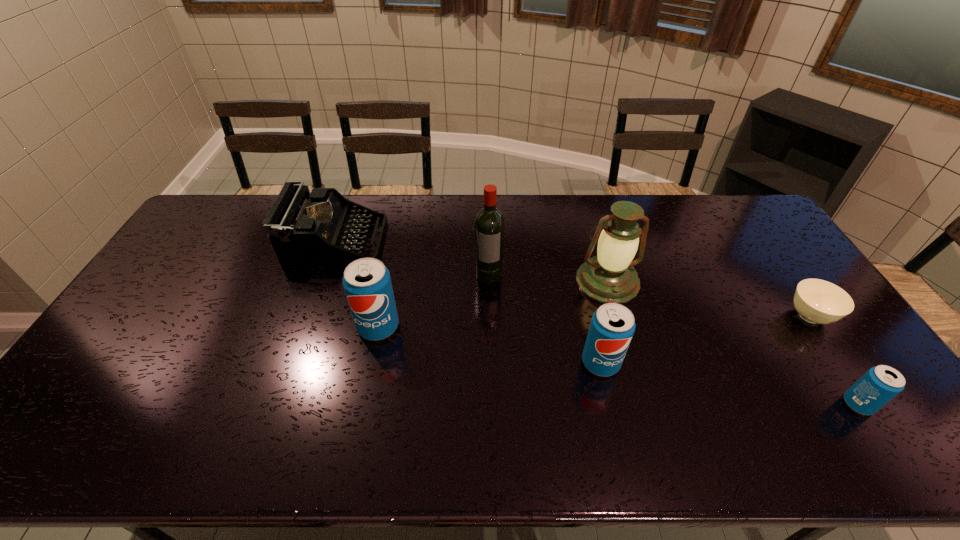
Locate an element on the screen. free region located on the left of the second nearest soda can is located at coordinates (559, 363).

Locate an element on the screen. The width and height of the screenshot is (960, 540). free space located on the left of the rightmost soda can is located at coordinates (714, 404).

Identify the location of vacant region located 0.370m on the label of the third object from left to right. (491, 388).

The height and width of the screenshot is (540, 960). Find the location of `vacant space situated with the light compartment facing forward on the lantern`. vacant space situated with the light compartment facing forward on the lantern is located at coordinates (642, 401).

Locate an element on the screen. blank area located on the typing side of the typewriter is located at coordinates (420, 241).

I want to click on vacant space situated 0.150m on the left of the shortest object, so click(x=734, y=316).

Image resolution: width=960 pixels, height=540 pixels. Identify the location of object at the far edge. (304, 228).

Locate an element on the screen. The width and height of the screenshot is (960, 540). object at the near edge is located at coordinates (880, 384).

Where is `soda can that is at the right edge`? The image size is (960, 540). soda can that is at the right edge is located at coordinates (880, 384).

Locate an element on the screen. The image size is (960, 540). sugar bowl that is positioned at the right edge is located at coordinates (817, 301).